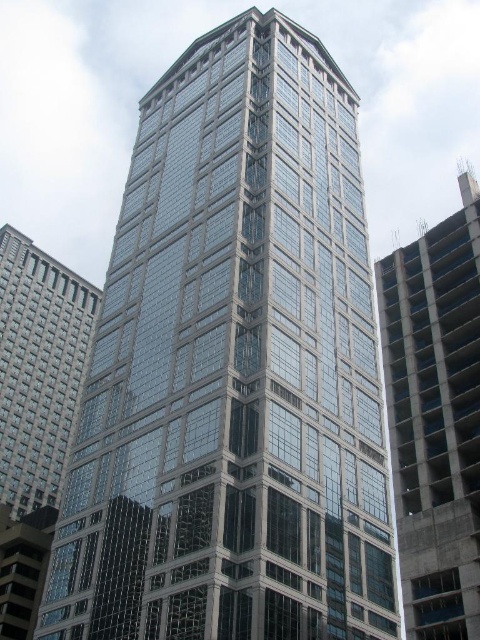
Question: Is concrete at right to the right of matte glass building at left from the viewer's perspective?

Choices:
 (A) yes
 (B) no

Answer: (A)

Question: Is concrete at right smaller than matte glass building at left?

Choices:
 (A) yes
 (B) no

Answer: (B)

Question: Which point appears farthest from the camera in this image?

Choices:
 (A) (6, 416)
 (B) (384, 264)

Answer: (A)

Question: From the image, what is the correct spatial relationship of concrete at right in relation to matte glass building at left?

Choices:
 (A) left
 (B) right

Answer: (B)